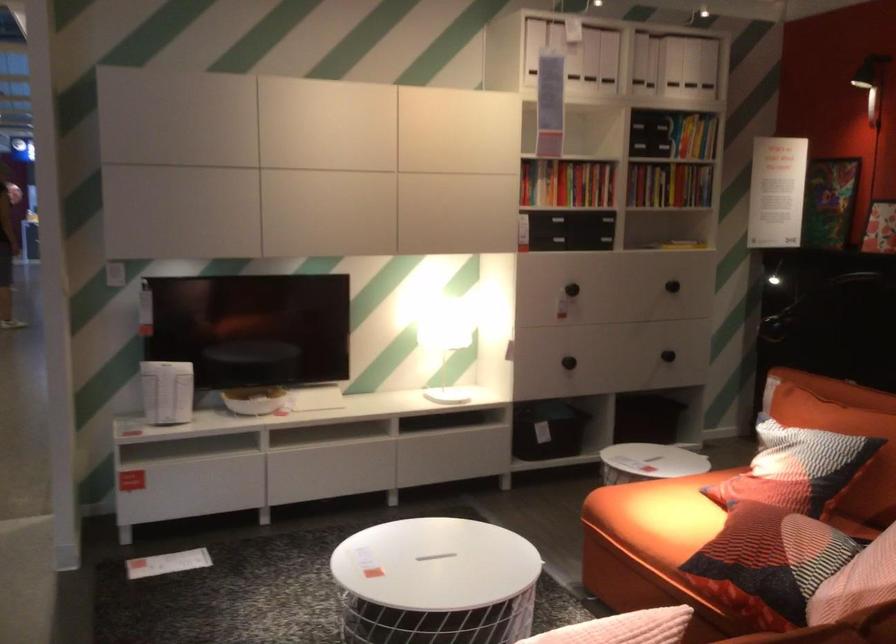
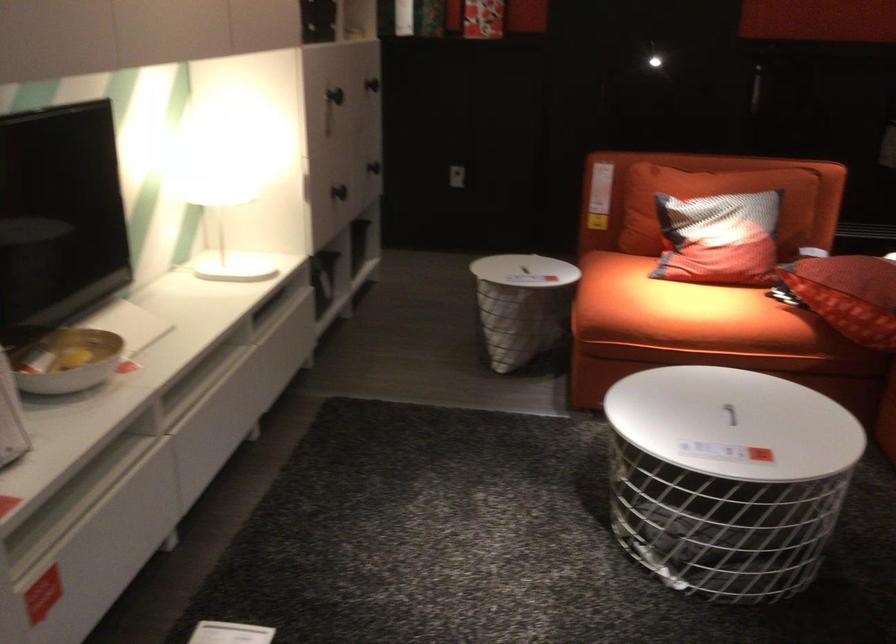
In the second image, find the point that corresponds to the point at 290,397 in the first image.

(66, 361)